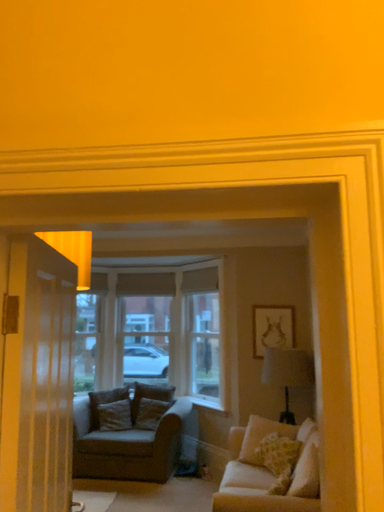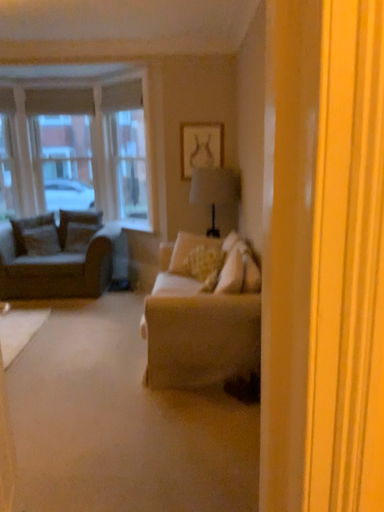
Question: How did the camera likely rotate when shooting the video?

Choices:
 (A) rotated right
 (B) rotated left

Answer: (A)